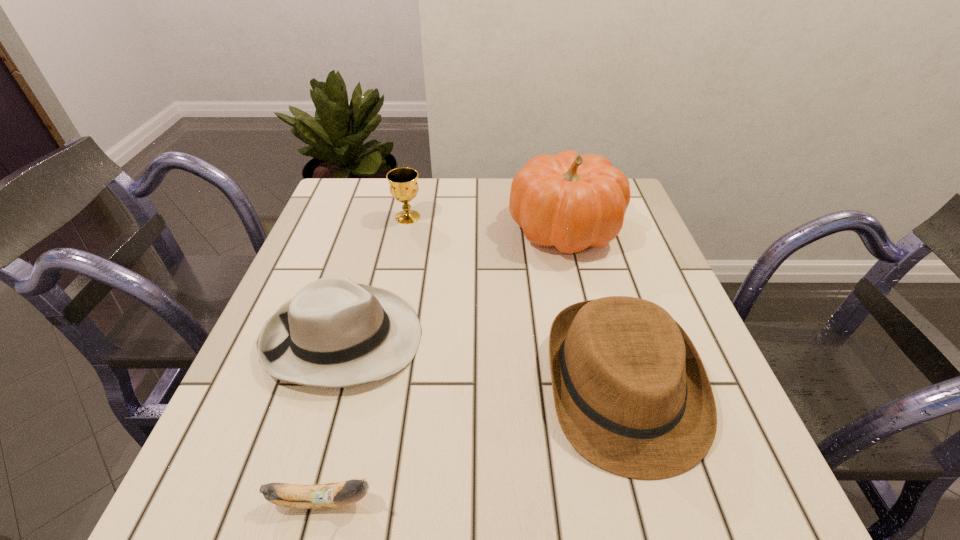
Identify the location of pumpkin. (569, 201).

You are a GUI agent. You are given a task and a screenshot of the screen. Output one action in this format:
    pyautogui.click(x=<x>, y=<y>)
    Task: Click on the chalice
    The height and width of the screenshot is (540, 960).
    Given the screenshot: What is the action you would take?
    pyautogui.click(x=403, y=183)

Image resolution: width=960 pixels, height=540 pixels. Identify the location of the left fedora. (334, 332).

What are the coordinates of `the right fedora` in the screenshot? It's located at (632, 396).

Where is `the nearest object`? the nearest object is located at coordinates (329, 495).

This screenshot has height=540, width=960. Find the location of `the shortest object`. the shortest object is located at coordinates (329, 495).

Locate an element on the screen. This screenshot has height=540, width=960. vacant area situated on the left of the tallest object is located at coordinates (373, 228).

Locate an element on the screen. blank space located on the back of the chalice is located at coordinates (415, 183).

Where is `free location located 0.060m on the front-facing side of the left fedora`? free location located 0.060m on the front-facing side of the left fedora is located at coordinates (451, 338).

Find the location of a particular element. vacant space located 0.200m on the peel of the shortest object is located at coordinates (513, 501).